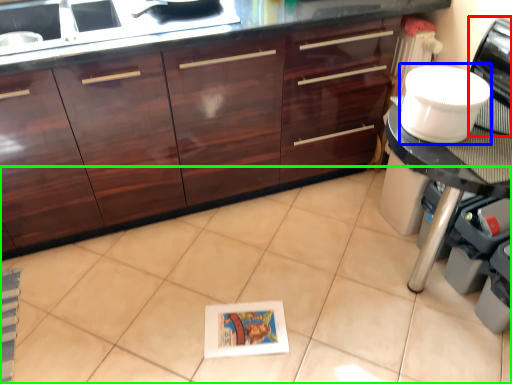
Question: Estimate the real-world distances between objects in this image. Which object is farther from home appliance (highlighted by a red box), appliance (highlighted by a blue box) or ceramic tile (highlighted by a green box)?

Choices:
 (A) appliance
 (B) ceramic tile

Answer: (B)